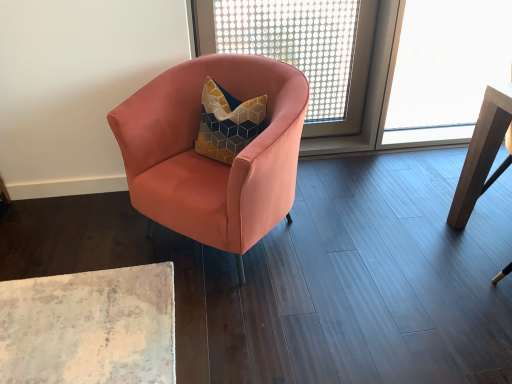
Question: Could you tell me if matte pink armchair at center is turned towards wooden table at right?

Choices:
 (A) no
 (B) yes

Answer: (A)

Question: From a real-world perspective, is matte pink armchair at center physically above wooden table at right?

Choices:
 (A) no
 (B) yes

Answer: (A)

Question: Considering the relative positions of matte pink armchair at center and wooden table at right in the image provided, is matte pink armchair at center behind wooden table at right?

Choices:
 (A) yes
 (B) no

Answer: (B)

Question: Does matte pink armchair at center touch wooden table at right?

Choices:
 (A) no
 (B) yes

Answer: (A)

Question: Does matte pink armchair at center have a smaller size compared to wooden table at right?

Choices:
 (A) no
 (B) yes

Answer: (A)

Question: Does matte pink armchair at center have a lesser width compared to wooden table at right?

Choices:
 (A) yes
 (B) no

Answer: (B)

Question: Considering the relative positions of matte pink armchair at center and transparent plastic screen at upper center in the image provided, is matte pink armchair at center to the right of transparent plastic screen at upper center from the viewer's perspective?

Choices:
 (A) yes
 (B) no

Answer: (B)

Question: From a real-world perspective, does matte pink armchair at center stand above transparent plastic screen at upper center?

Choices:
 (A) no
 (B) yes

Answer: (A)

Question: From the image's perspective, is matte pink armchair at center located above transparent plastic screen at upper center?

Choices:
 (A) no
 (B) yes

Answer: (A)

Question: From the image's perspective, would you say matte pink armchair at center is shown under transparent plastic screen at upper center?

Choices:
 (A) yes
 (B) no

Answer: (A)

Question: Is matte pink armchair at center wider than transparent plastic screen at upper center?

Choices:
 (A) no
 (B) yes

Answer: (B)

Question: Is matte pink armchair at center positioned with its back to transparent plastic screen at upper center?

Choices:
 (A) no
 (B) yes

Answer: (B)

Question: From the image's perspective, is transparent plastic screen at upper center under wooden table at right?

Choices:
 (A) no
 (B) yes

Answer: (A)